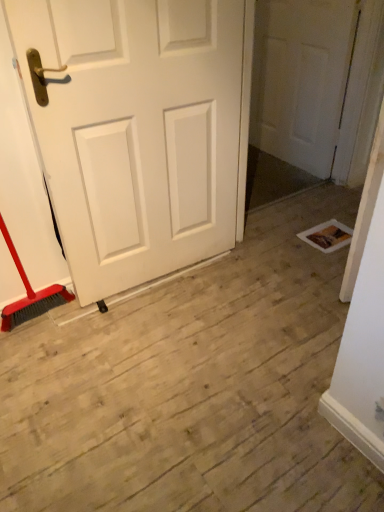
Locate an element on the screen. vacant area that lies to the right of white matte door at left, marked as the second door in a back-to-front arrangement is located at coordinates (238, 297).